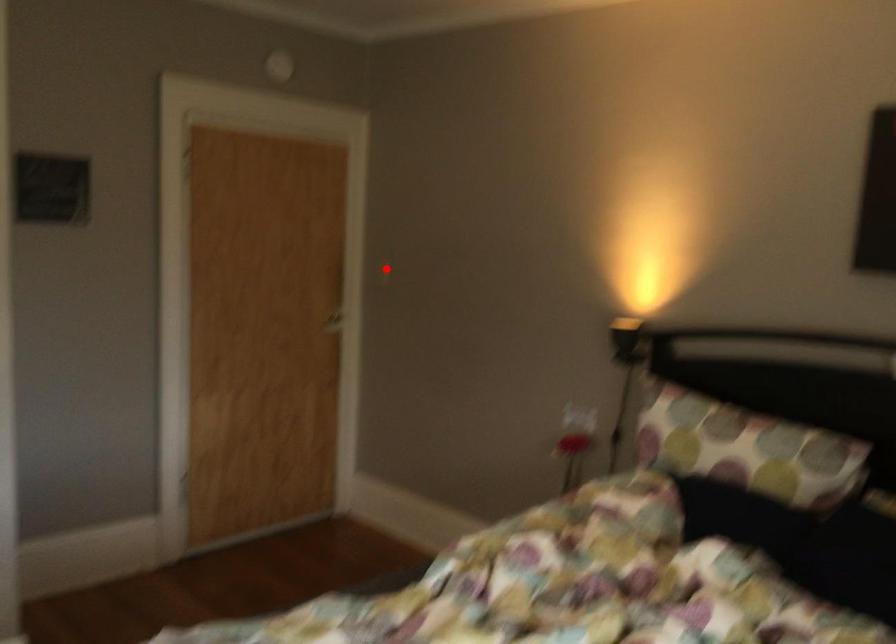
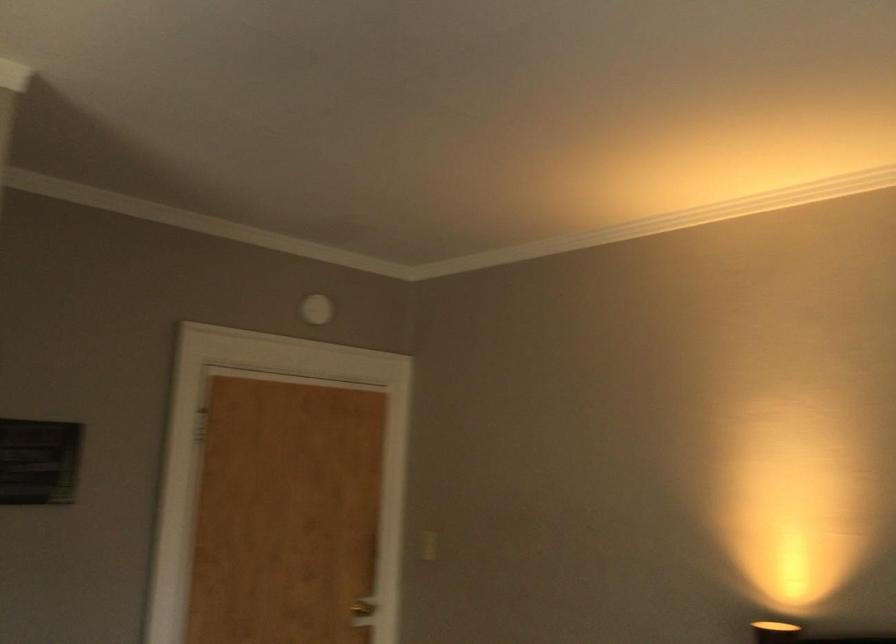
Locate, in the second image, the point that corresponds to the highlighted location in the first image.

(427, 545)